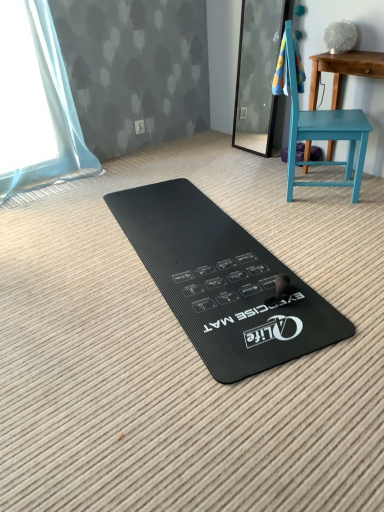
Question: Is teal painted wood table at right behind blue textured towel at upper right?

Choices:
 (A) no
 (B) yes

Answer: (B)

Question: Is teal painted wood table at right looking in the opposite direction of blue textured towel at upper right?

Choices:
 (A) no
 (B) yes

Answer: (A)

Question: From a real-world perspective, does teal painted wood table at right stand above blue textured towel at upper right?

Choices:
 (A) no
 (B) yes

Answer: (A)

Question: Could you tell me if teal painted wood table at right is turned towards blue textured towel at upper right?

Choices:
 (A) no
 (B) yes

Answer: (B)

Question: Can you confirm if teal painted wood table at right is smaller than blue textured towel at upper right?

Choices:
 (A) no
 (B) yes

Answer: (A)

Question: Looking at the image, does teal matte chair at right seem bigger or smaller compared to blue textured towel at upper right?

Choices:
 (A) small
 (B) big

Answer: (B)

Question: From a real-world perspective, is teal matte chair at right physically located above or below blue textured towel at upper right?

Choices:
 (A) above
 (B) below

Answer: (B)

Question: Is point (294, 71) closer or farther from the camera than point (299, 88)?

Choices:
 (A) closer
 (B) farther

Answer: (A)

Question: From the image's perspective, is teal matte chair at right positioned above or below blue textured towel at upper right?

Choices:
 (A) above
 (B) below

Answer: (B)

Question: Is point (345, 124) closer or farther from the camera than point (178, 205)?

Choices:
 (A) farther
 (B) closer

Answer: (B)

Question: Considering the relative positions of teal matte chair at right and black rubber exercise mat at center in the image provided, is teal matte chair at right to the left or to the right of black rubber exercise mat at center?

Choices:
 (A) right
 (B) left

Answer: (A)

Question: Considering the positions of teal matte chair at right and black rubber exercise mat at center in the image, is teal matte chair at right taller or shorter than black rubber exercise mat at center?

Choices:
 (A) tall
 (B) short

Answer: (A)

Question: Is teal matte chair at right inside or outside of black rubber exercise mat at center?

Choices:
 (A) inside
 (B) outside

Answer: (B)

Question: From the image's perspective, is blue textured towel at upper right above or below black rubber exercise mat at center?

Choices:
 (A) below
 (B) above

Answer: (B)

Question: Considering their positions, is blue textured towel at upper right located in front of or behind black rubber exercise mat at center?

Choices:
 (A) front
 (B) behind

Answer: (B)